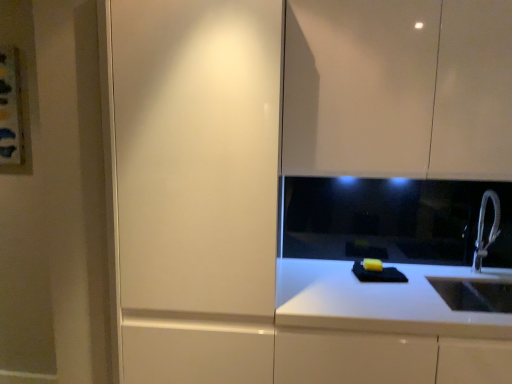
Question: Does glossy white cabinet at upper right have a lesser width compared to white metallic faucet at right?

Choices:
 (A) no
 (B) yes

Answer: (A)

Question: From a real-world perspective, is glossy white cabinet at upper right below white metallic faucet at right?

Choices:
 (A) yes
 (B) no

Answer: (B)

Question: Can you confirm if glossy white cabinet at upper right is smaller than white metallic faucet at right?

Choices:
 (A) no
 (B) yes

Answer: (A)

Question: Is white metallic faucet at right a part of glossy white cabinet at upper right?

Choices:
 (A) no
 (B) yes

Answer: (A)

Question: From a real-world perspective, does glossy white cabinet at upper right stand above white metallic faucet at right?

Choices:
 (A) yes
 (B) no

Answer: (A)

Question: Does glossy white cabinet at upper right have a greater height compared to white metallic faucet at right?

Choices:
 (A) no
 (B) yes

Answer: (B)

Question: Does white metallic faucet at right have a greater width compared to glossy white cabinet at upper right?

Choices:
 (A) yes
 (B) no

Answer: (B)

Question: From a real-world perspective, is white metallic faucet at right positioned over glossy white cabinet at upper right based on gravity?

Choices:
 (A) no
 (B) yes

Answer: (A)

Question: Does white metallic faucet at right have a lesser height compared to glossy white cabinet at upper right?

Choices:
 (A) no
 (B) yes

Answer: (B)

Question: Is white metallic faucet at right aimed at glossy white cabinet at upper right?

Choices:
 (A) no
 (B) yes

Answer: (A)

Question: Could glossy white cabinet at upper right be considered to be inside white metallic faucet at right?

Choices:
 (A) yes
 (B) no

Answer: (B)

Question: Would you say white metallic faucet at right is a long distance from glossy white cabinet at upper right?

Choices:
 (A) no
 (B) yes

Answer: (A)

Question: Would you say matte white cabinet at left is outside glossy white cabinet at upper right?

Choices:
 (A) no
 (B) yes

Answer: (B)